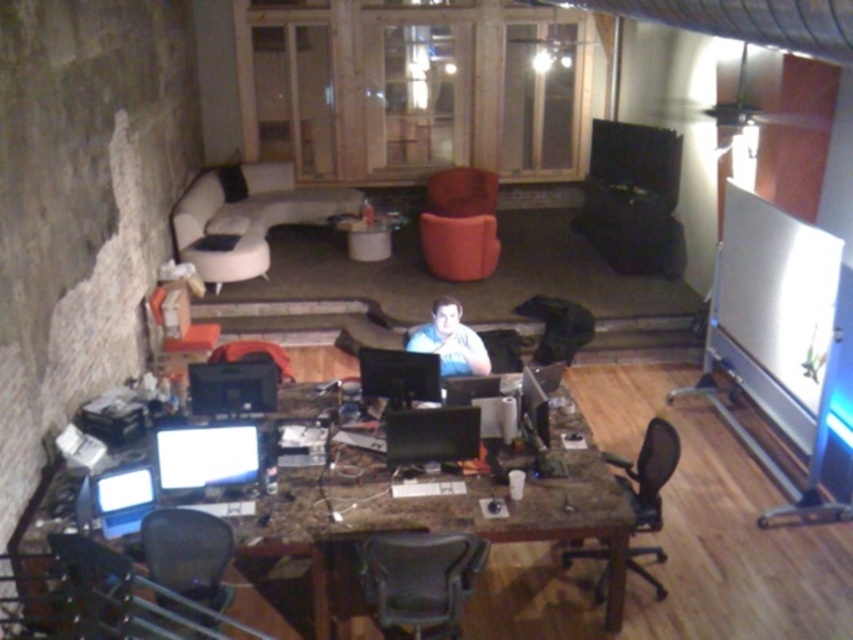
Question: Which point is farther to the camera?

Choices:
 (A) matte black chair at lower left
 (B) white leather couch at upper left

Answer: (B)

Question: Can you confirm if matte black office chair at center is smaller than matte black chair at lower left?

Choices:
 (A) yes
 (B) no

Answer: (B)

Question: Observing the image, what is the correct spatial positioning of marble desk at center in reference to matte black chair at lower left?

Choices:
 (A) right
 (B) left

Answer: (A)

Question: Which of these objects is positioned farthest from the matte black office chair at center?

Choices:
 (A) velvet orange armchair at center
 (B) matte black chair at lower left

Answer: (A)

Question: Among these points, which one is farthest from the camera?

Choices:
 (A) click(x=155, y=548)
 (B) click(x=425, y=352)
 (C) click(x=96, y=579)

Answer: (B)

Question: Is matte black office chair at center positioned before light blue shirt at center?

Choices:
 (A) yes
 (B) no

Answer: (A)